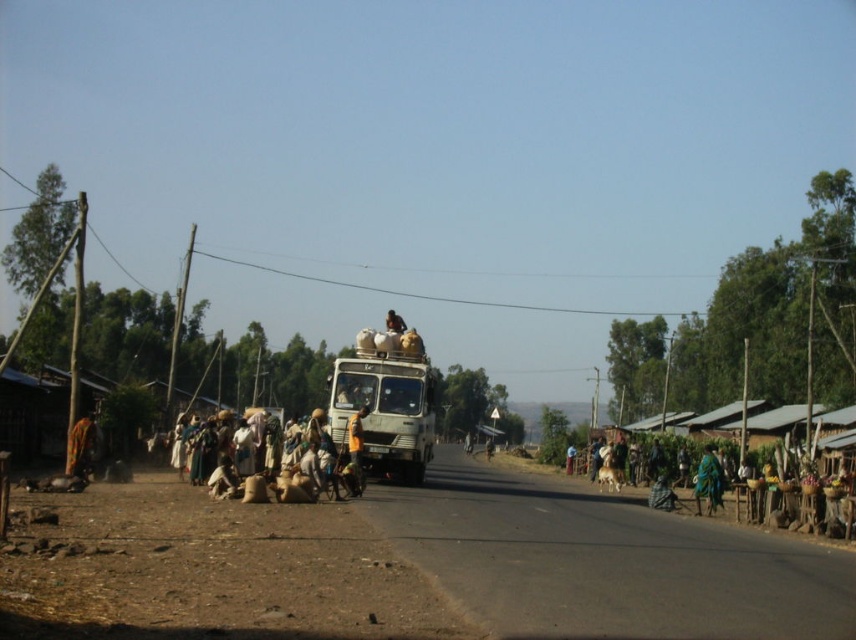
You are a pedestrian standing at the lower left of the image. You want to cross the road to the green matte truck at center. Which direction should you walk to avoid the white fabric people at lower left?

The green matte truck at center is to the right of the white fabric people at lower left, so you should walk to the right to avoid them and reach the truck.

You are a photographer standing at the camera position. You want to take a photo that includes both the point at (337,384) and the point at (360,424). Which point should you focus on first to ensure both are in focus?

You should focus on the point at (337,384) first because it is closer to the camera than the point at (360,424). This ensures that both points will be within the depth of field.